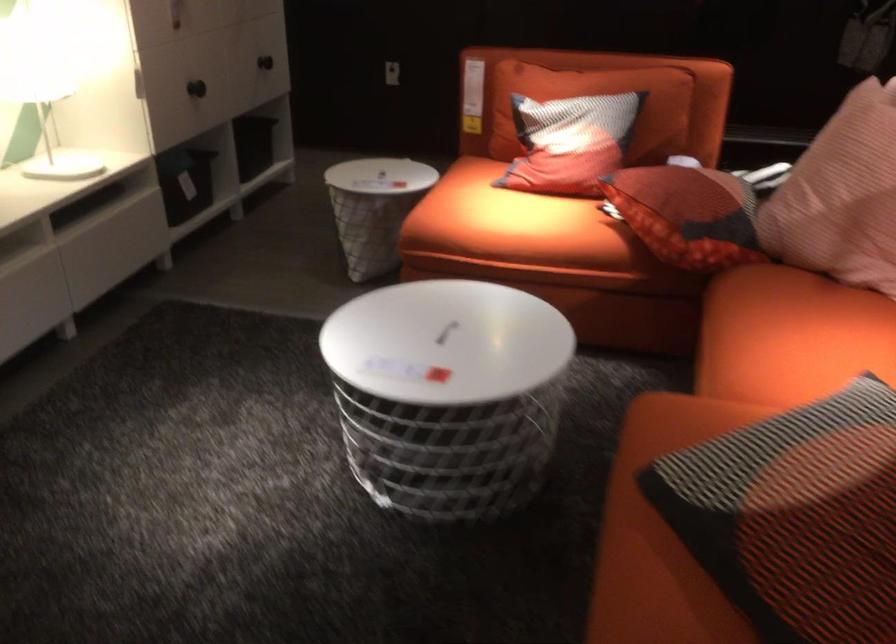
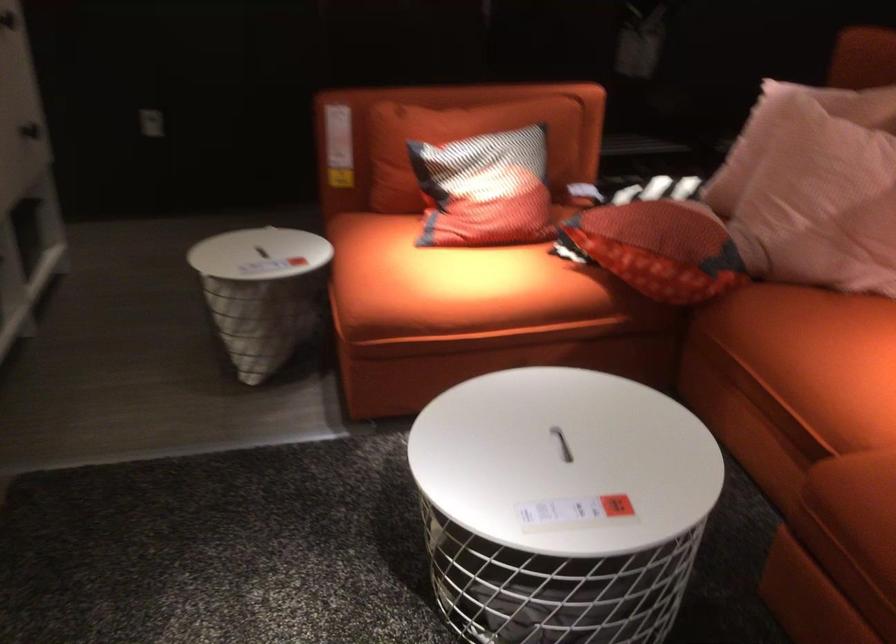
The images are taken continuously from a first-person perspective. In which direction are you moving?

The cameraman walked toward left, forward.